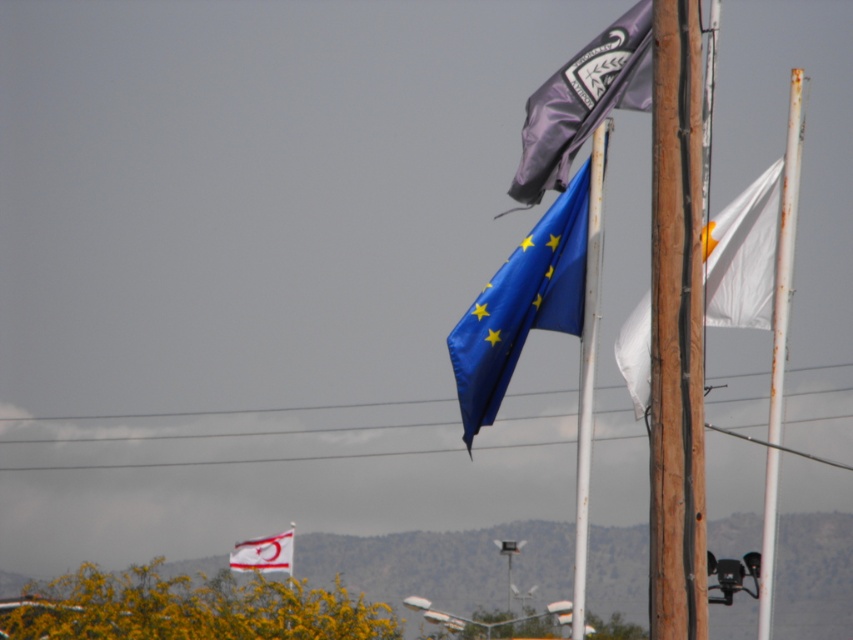
Question: From the image, what is the correct spatial relationship of purple matte flag at upper center in relation to wooden pole at center-right?

Choices:
 (A) right
 (B) left

Answer: (A)

Question: Which of the following is the farthest from the observer?

Choices:
 (A) (659, 285)
 (B) (590, 444)

Answer: (B)

Question: Which point is closer to the camera?

Choices:
 (A) (581, 404)
 (B) (288, 541)
 (C) (764, 492)

Answer: (C)

Question: Can you confirm if purple matte flag at upper center is smaller than white fabric flag at lower center?

Choices:
 (A) yes
 (B) no

Answer: (B)

Question: Is white fabric flag at right to the right of metallic wire at upper center from the viewer's perspective?

Choices:
 (A) yes
 (B) no

Answer: (A)

Question: Among these objects, which one is nearest to the camera?

Choices:
 (A) wooden pole at center-right
 (B) white fabric flag at lower center

Answer: (A)